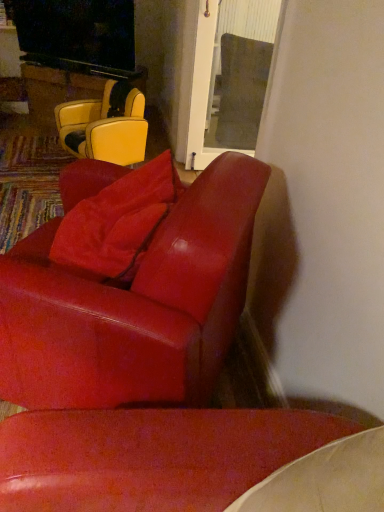
Question: Is suede-like red pillow at center to the right of leather yellow chair at upper left, placed as the 2th chair when sorted from bottom to top, from the viewer's perspective?

Choices:
 (A) yes
 (B) no

Answer: (A)

Question: Does suede-like red pillow at center appear on the left side of leather yellow chair at upper left, acting as the 1th chair starting from the top?

Choices:
 (A) no
 (B) yes

Answer: (A)

Question: Is suede-like red pillow at center oriented away from leather yellow chair at upper left, which ranks as the 2th chair in front-to-back order?

Choices:
 (A) yes
 (B) no

Answer: (B)

Question: Can you confirm if suede-like red pillow at center is wider than leather yellow chair at upper left, which is the first chair from back to front?

Choices:
 (A) no
 (B) yes

Answer: (A)

Question: Does suede-like red pillow at center have a greater height compared to leather yellow chair at upper left, which ranks as the 2th chair in front-to-back order?

Choices:
 (A) no
 (B) yes

Answer: (A)

Question: Is suede-like red pillow at center bigger or smaller than matte red leather chair at center, positioned as the first chair in bottom-to-top order?

Choices:
 (A) small
 (B) big

Answer: (A)

Question: From a real-world perspective, relative to matte red leather chair at center, positioned as the 1th chair in front-to-back order, is suede-like red pillow at center vertically above or below?

Choices:
 (A) below
 (B) above

Answer: (B)

Question: Is suede-like red pillow at center inside or outside of matte red leather chair at center, arranged as the second chair when viewed from the top?

Choices:
 (A) inside
 (B) outside

Answer: (A)

Question: Based on their positions, is suede-like red pillow at center located to the left or right of matte red leather chair at center, positioned as the 1th chair in front-to-back order?

Choices:
 (A) right
 (B) left

Answer: (A)

Question: Is wooden glossy table at upper left inside or outside of matte red leather chair at center, marked as the second chair in a back-to-front arrangement?

Choices:
 (A) outside
 (B) inside

Answer: (A)

Question: Would you say wooden glossy table at upper left is to the left or to the right of matte red leather chair at center, positioned as the first chair in bottom-to-top order, in the picture?

Choices:
 (A) left
 (B) right

Answer: (A)

Question: From the image's perspective, is wooden glossy table at upper left positioned above or below matte red leather chair at center, positioned as the 1th chair in front-to-back order?

Choices:
 (A) below
 (B) above

Answer: (B)

Question: Looking at their shapes, would you say wooden glossy table at upper left is wider or thinner than matte red leather chair at center, arranged as the second chair when viewed from the top?

Choices:
 (A) thin
 (B) wide

Answer: (A)

Question: Considering the positions of point (114, 238) and point (117, 138), is point (114, 238) closer or farther from the camera than point (117, 138)?

Choices:
 (A) farther
 (B) closer

Answer: (B)

Question: From a real-world perspective, is suede-like red pillow at center above or below leather yellow chair at upper left, acting as the 1th chair starting from the top?

Choices:
 (A) below
 (B) above

Answer: (B)